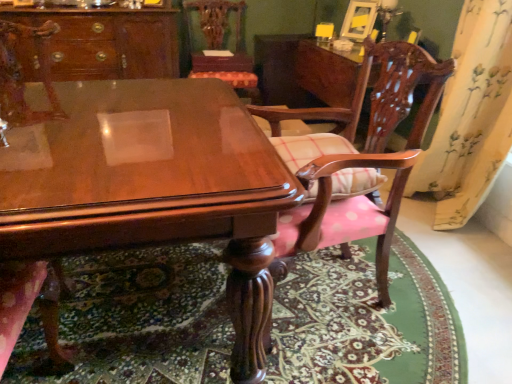
This screenshot has height=384, width=512. Identify the location of polished wood chair at lower left, marked as the first chair in a front-to-back arrangement. (23, 78).

Describe the element at coordinates (153, 186) in the screenshot. I see `glossy wood table at center` at that location.

In order to face glossy wood table at center, should I rotate leftwards or rightwards?

You should rotate left by 20.325 degrees.

The height and width of the screenshot is (384, 512). What are the coordinates of `carpeted floor at lower center` in the screenshot? It's located at (138, 320).

Measure the distance between point (468, 174) and camera.

7.54 feet.

You are a GUI agent. You are given a task and a screenshot of the screen. Output one action in this format:
    pyautogui.click(x=<x>, y=<y>)
    Task: Click on the wooden chair with cushion at center, the second chair in the back-to-front sequence
    
    Given the screenshot: What is the action you would take?
    (x=357, y=157)

Locate an element on the screen. glossy wood cabinet at upper left is located at coordinates (108, 42).

Where is `polished wood chair at lower left, which is the third chair in back-to-front order`? The height and width of the screenshot is (384, 512). polished wood chair at lower left, which is the third chair in back-to-front order is located at coordinates (23, 78).

Is wooden chair with cushion at center, the second chair in the back-to-front sequence, positioned with its back to polished wood chair at lower left, marked as the first chair in a front-to-back arrangement?

wooden chair with cushion at center, the second chair in the back-to-front sequence, does not have its back to polished wood chair at lower left, marked as the first chair in a front-to-back arrangement.

From the image's perspective, which is below, wooden chair with cushion at center, which is the 2th chair from front to back, or polished wood chair at lower left, marked as the first chair in a front-to-back arrangement?

From the image's view, polished wood chair at lower left, marked as the first chair in a front-to-back arrangement, is below.

Which object is further away from the camera taking this photo, wooden chair with cushion at center, the second chair in the back-to-front sequence, or polished wood chair at lower left, which is the third chair in back-to-front order?

wooden chair with cushion at center, the second chair in the back-to-front sequence, is more distant.

From the image's perspective, is glossy wood table at center located above or below wooden chair at upper center, the 1th chair from the back?

From the image's perspective, glossy wood table at center appears below wooden chair at upper center, the 1th chair from the back.

Does glossy wood table at center have a lesser width compared to wooden chair at upper center, the third chair in the front-to-back sequence?

Incorrect, the width of glossy wood table at center is not less than that of wooden chair at upper center, the third chair in the front-to-back sequence.

From a real-world perspective, relative to wooden chair at upper center, the third chair in the front-to-back sequence, is glossy wood table at center vertically above or below?

glossy wood table at center is situated lower than wooden chair at upper center, the third chair in the front-to-back sequence, in the real world.

How far apart are glossy wood table at center and wooden chair at upper center, the 1th chair from the back?

glossy wood table at center and wooden chair at upper center, the 1th chair from the back, are 2.01 meters apart.

In terms of height, does glossy wood table at center look taller or shorter compared to yellow floral fabric at right?

In the image, glossy wood table at center appears to be shorter than yellow floral fabric at right.

Is yellow floral fabric at right at the back of glossy wood table at center?

No, glossy wood table at center is not facing the opposite direction of yellow floral fabric at right.

Considering the positions of point (136, 243) and point (458, 138), is point (136, 243) closer or farther from the camera than point (458, 138)?

Point (136, 243) is positioned closer to the camera compared to point (458, 138).

What's the angular difference between glossy wood table at center and yellow floral fabric at right's facing directions?

glossy wood table at center and yellow floral fabric at right are facing 93.2 degrees away from each other.

Image resolution: width=512 pixels, height=384 pixels. Find the location of `table located behind the polished wood chair at lower left, which is the third chair in back-to-front order`. table located behind the polished wood chair at lower left, which is the third chair in back-to-front order is located at coordinates (153, 186).

Can you confirm if polished wood chair at lower left, marked as the first chair in a front-to-back arrangement, is shorter than glossy wood table at center?

Incorrect, the height of polished wood chair at lower left, marked as the first chair in a front-to-back arrangement, does not fall short of that of glossy wood table at center.

What's the angular difference between polished wood chair at lower left, which is the third chair in back-to-front order, and glossy wood table at center's facing directions?

There is a 4.14-degree angle between the facing directions of polished wood chair at lower left, which is the third chair in back-to-front order, and glossy wood table at center.

From a real-world perspective, relative to glossy wood table at center, is polished wood chair at lower left, marked as the first chair in a front-to-back arrangement, vertically above or below?

In terms of real-world spatial position, polished wood chair at lower left, marked as the first chair in a front-to-back arrangement, is above glossy wood table at center.

From the image's perspective, is polished wood chair at lower left, which is the third chair in back-to-front order, located above or below wooden chair with cushion at center, which is the 2th chair from front to back?

polished wood chair at lower left, which is the third chair in back-to-front order, is situated lower than wooden chair with cushion at center, which is the 2th chair from front to back, in the image.

Is polished wood chair at lower left, which is the third chair in back-to-front order, further to the viewer compared to wooden chair with cushion at center, the second chair in the back-to-front sequence?

No, polished wood chair at lower left, which is the third chair in back-to-front order, is closer to the camera.

Could you tell me if polished wood chair at lower left, which is the third chair in back-to-front order, is facing wooden chair with cushion at center, which is the 2th chair from front to back?

No, polished wood chair at lower left, which is the third chair in back-to-front order, does not turn towards wooden chair with cushion at center, which is the 2th chair from front to back.

Does point (11, 295) come behind point (385, 115)?

No, (11, 295) is in front of (385, 115).

In the scene shown: Considering the relative positions of polished wood chair at lower left, marked as the first chair in a front-to-back arrangement, and glossy wood cabinet at upper left in the image provided, is polished wood chair at lower left, marked as the first chair in a front-to-back arrangement, to the right of glossy wood cabinet at upper left from the viewer's perspective?

Indeed, polished wood chair at lower left, marked as the first chair in a front-to-back arrangement, is positioned on the right side of glossy wood cabinet at upper left.

Are polished wood chair at lower left, marked as the first chair in a front-to-back arrangement, and glossy wood cabinet at upper left far apart?

They are positioned close to each other.

From a real-world perspective, which is physically above, polished wood chair at lower left, which is the third chair in back-to-front order, or glossy wood cabinet at upper left?

From a 3D spatial view, glossy wood cabinet at upper left is above.

Can you tell me how much polished wood chair at lower left, marked as the first chair in a front-to-back arrangement, and glossy wood cabinet at upper left differ in facing direction?

The angular difference between polished wood chair at lower left, marked as the first chair in a front-to-back arrangement, and glossy wood cabinet at upper left is 177 degrees.

Who is shorter, glossy wood table at center or wooden chair with cushion at center, which is the 2th chair from front to back?

glossy wood table at center is shorter.

From a real-world perspective, is glossy wood table at center physically located above or below wooden chair with cushion at center, which is the 2th chair from front to back?

Clearly, from a real-world perspective, glossy wood table at center is below wooden chair with cushion at center, which is the 2th chair from front to back.

You are a GUI agent. You are given a task and a screenshot of the screen. Output one action in this format:
    pyautogui.click(x=<x>, y=<y>)
    Task: Click on the table in front of the wooden chair with cushion at center, the second chair in the back-to-front sequence
    This screenshot has height=384, width=512.
    Given the screenshot: What is the action you would take?
    pyautogui.click(x=153, y=186)

Is glossy wood table at center next to wooden chair with cushion at center, which is the 2th chair from front to back, and touching it?

They are not placed beside each other.

Identify the location of chair that is under the wooden chair with cushion at center, the second chair in the back-to-front sequence (from a real-world perspective). (23, 78).

This screenshot has width=512, height=384. I want to click on the 1st chair to the right when counting from the glossy wood table at center, so click(x=220, y=45).

Estimate the real-world distances between objects in this image. Which object is further from glossy wood table at center, wooden chair at upper center, the 1th chair from the back, or glossy wood cabinet at upper left?

The object further to glossy wood table at center is wooden chair at upper center, the 1th chair from the back.

When comparing their distances from glossy wood cabinet at upper left, does yellow floral fabric at right or polished wood chair at lower left, marked as the first chair in a front-to-back arrangement, seem further?

Among the two, yellow floral fabric at right is located further to glossy wood cabinet at upper left.

Estimate the real-world distances between objects in this image. Which object is further from wooden chair with cushion at center, the second chair in the back-to-front sequence, wooden chair at upper center, the third chair in the front-to-back sequence, or glossy wood table at center?

wooden chair at upper center, the third chair in the front-to-back sequence, lies further to wooden chair with cushion at center, the second chair in the back-to-front sequence, than the other object.

Estimate the real-world distances between objects in this image. Which object is closer to glossy wood table at center, wooden chair at upper center, the third chair in the front-to-back sequence, or yellow floral fabric at right?

yellow floral fabric at right lies closer to glossy wood table at center than the other object.

When comparing their distances from yellow floral fabric at right, does polished wood chair at lower left, which is the third chair in back-to-front order, or carpeted floor at lower center seem further?

polished wood chair at lower left, which is the third chair in back-to-front order.

Looking at the image, which one is located further to glossy wood cabinet at upper left, yellow floral fabric at right or carpeted floor at lower center?

Among the two, yellow floral fabric at right is located further to glossy wood cabinet at upper left.

Which object lies further to the anchor point carpeted floor at lower center, wooden chair at upper center, the third chair in the front-to-back sequence, or glossy wood cabinet at upper left?

→ Among the two, wooden chair at upper center, the third chair in the front-to-back sequence, is located further to carpeted floor at lower center.

When comparing their distances from wooden chair with cushion at center, which is the 2th chair from front to back, does yellow floral fabric at right or carpeted floor at lower center seem closer?

Based on the image, carpeted floor at lower center appears to be nearer to wooden chair with cushion at center, which is the 2th chair from front to back.

In order to click on mat located between glossy wood table at center and glossy wood cabinet at upper left in the depth direction in this screenshot , I will do `click(138, 320)`.

Where is `curtain between carpeted floor at lower center and wooden chair at upper center, the third chair in the front-to-back sequence, in the front-back direction`? This screenshot has height=384, width=512. curtain between carpeted floor at lower center and wooden chair at upper center, the third chair in the front-to-back sequence, in the front-back direction is located at coordinates (x=471, y=117).

This screenshot has height=384, width=512. In order to click on curtain positioned between polished wood chair at lower left, marked as the first chair in a front-to-back arrangement, and wooden chair at upper center, the third chair in the front-to-back sequence, from near to far in this screenshot , I will do 471,117.

Locate an element on the screen. This screenshot has height=384, width=512. table between polished wood chair at lower left, which is the third chair in back-to-front order, and wooden chair at upper center, the 1th chair from the back, along the z-axis is located at coordinates (153, 186).